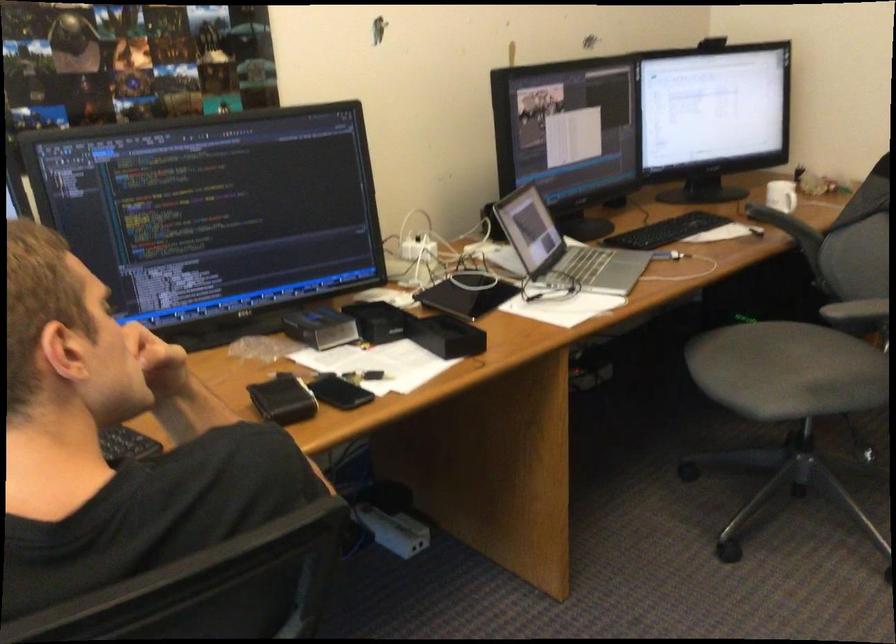
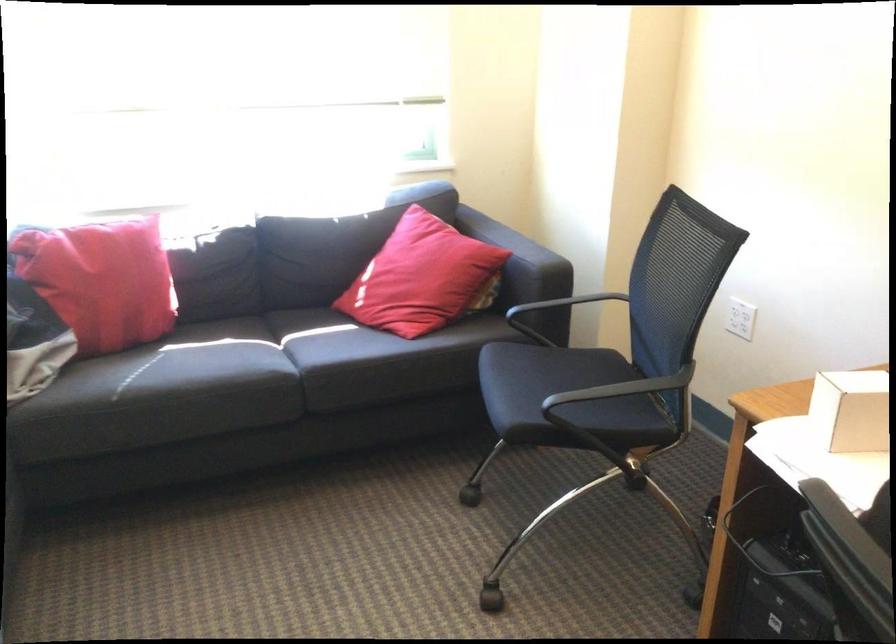
In the scene shown: Based on the continuous images, in which direction is the camera rotating?

The camera's rotation is toward left-down.